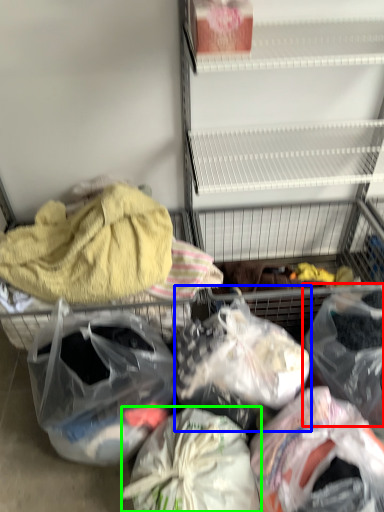
Question: Which object is the farthest from plastic bag (highlighted by a red box)? Choose among these: plastic bag (highlighted by a blue box) or plastic bag (highlighted by a green box).

Choices:
 (A) plastic bag
 (B) plastic bag

Answer: (B)